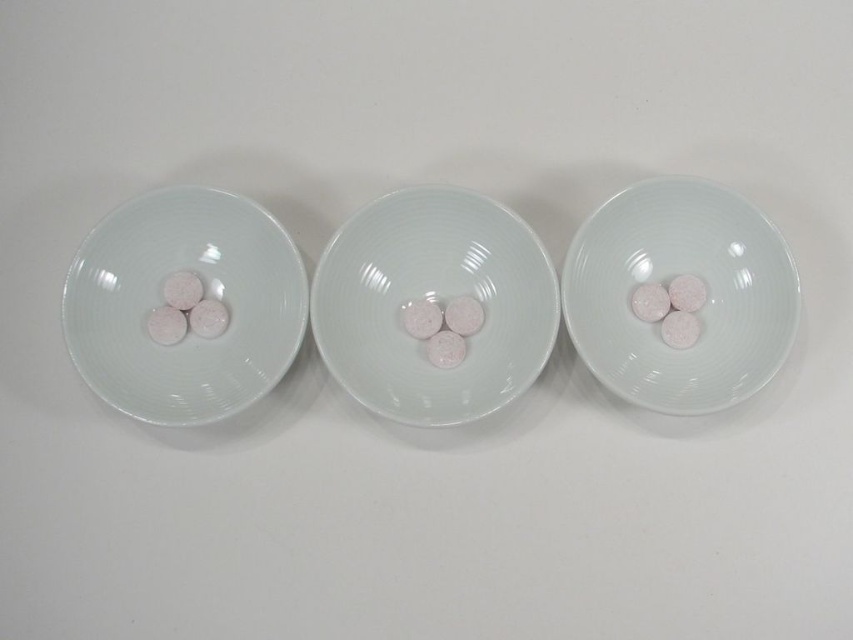
Question: Based on their relative distances, which object is farther from the white glossy plate at left?

Choices:
 (A) matte white plate at right
 (B) porcelain bowls at center

Answer: (A)

Question: Does porcelain bowls at center appear under matte white plate at right?

Choices:
 (A) yes
 (B) no

Answer: (A)

Question: Among these objects, which one is nearest to the camera?

Choices:
 (A) white glossy plate at left
 (B) porcelain bowls at center

Answer: (A)

Question: Does porcelain bowls at center have a lesser width compared to matte white plate at right?

Choices:
 (A) no
 (B) yes

Answer: (A)

Question: From the image, what is the correct spatial relationship of porcelain bowls at center in relation to white glossy plate at left?

Choices:
 (A) left
 (B) right

Answer: (B)

Question: Which point is farther to the camera?

Choices:
 (A) white glossy plate at left
 (B) matte white plate at right
 (C) porcelain bowls at center

Answer: (C)